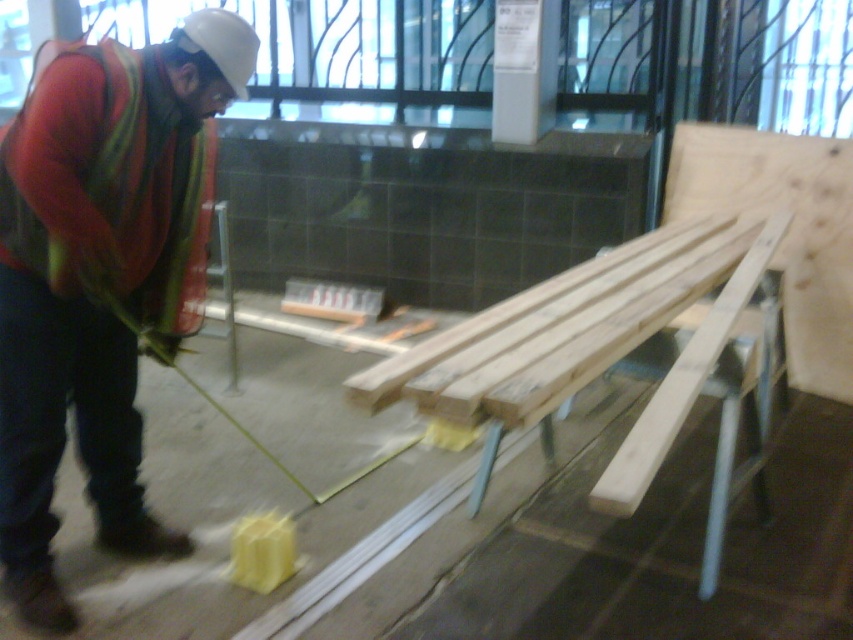
Question: Which point is closer to the camera taking this photo?

Choices:
 (A) (358, 396)
 (B) (15, 432)
 (C) (807, 316)

Answer: (A)

Question: Is orange safety vest at left smaller than natural wood at center?

Choices:
 (A) no
 (B) yes

Answer: (B)

Question: From the image, what is the correct spatial relationship of orange safety vest at left in relation to natural wood at center?

Choices:
 (A) above
 (B) below

Answer: (B)

Question: Which of the following is the closest to the observer?

Choices:
 (A) (51, 216)
 (B) (540, 401)
 (C) (764, 205)

Answer: (B)

Question: Among these points, which one is farthest from the camera?

Choices:
 (A) (601, 316)
 (B) (734, 161)

Answer: (B)

Question: Is orange safety vest at left below light brown wood at upper right?

Choices:
 (A) no
 (B) yes

Answer: (B)